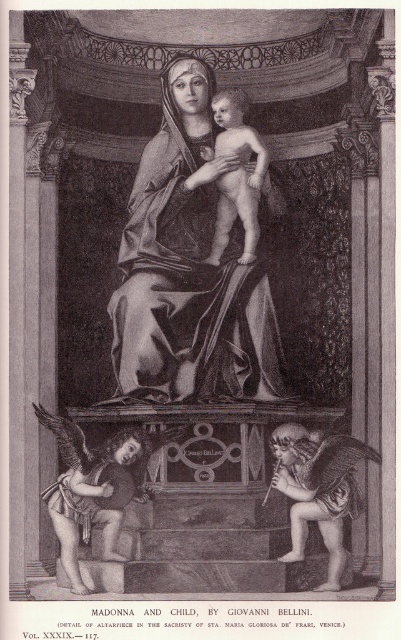
Who is lower down, smooth gray fabric at center or smooth flesh baby at center?

smooth gray fabric at center is lower down.

Is smooth gray fabric at center further to the viewer compared to smooth flesh baby at center?

That is False.

Find the location of a particular element. smooth gray fabric at center is located at coordinates (188, 269).

Image resolution: width=401 pixels, height=640 pixels. In order to click on smooth gray fabric at center in this screenshot , I will do `click(188, 269)`.